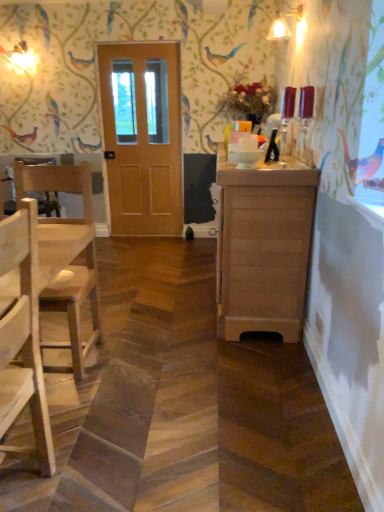
Question: Do you think natural wood chair at left, placed as the 2th chair when sorted from back to front, is within wooden cabinet at right, or outside of it?

Choices:
 (A) inside
 (B) outside

Answer: (B)

Question: In terms of width, does natural wood chair at left, arranged as the first chair when viewed from the front, look wider or thinner when compared to wooden cabinet at right?

Choices:
 (A) wide
 (B) thin

Answer: (B)

Question: Which object is positioned closest to the natural wood chair at left, the 1th chair when ordered from back to front?

Choices:
 (A) wooden cabinet at right
 (B) natural wood chair at left, arranged as the first chair when viewed from the front
 (C) wooden door at center

Answer: (B)

Question: Based on their relative distances, which object is nearer to the natural wood chair at left, arranged as the first chair when viewed from the front?

Choices:
 (A) wooden door at center
 (B) wooden cabinet at right
 (C) natural wood chair at left, the 1th chair when ordered from back to front

Answer: (C)